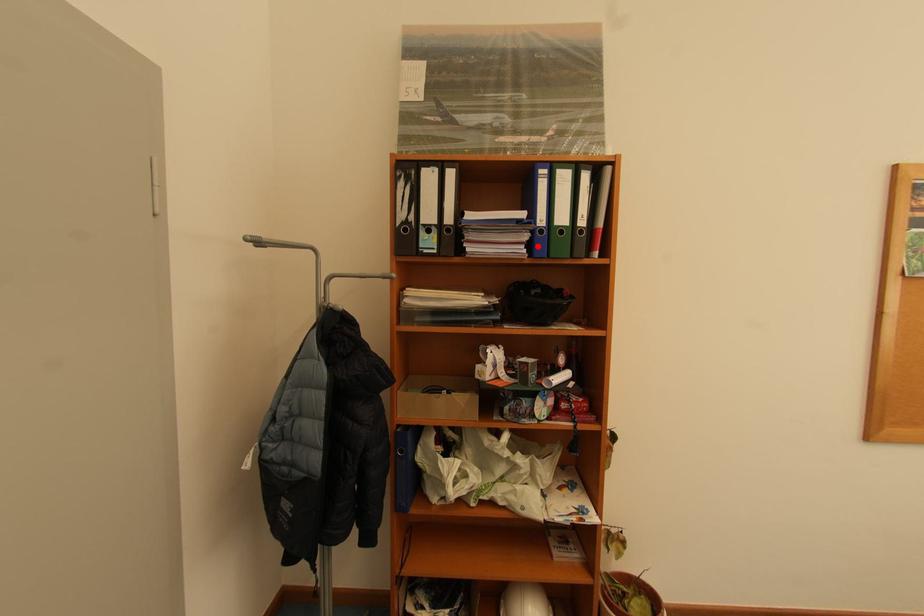
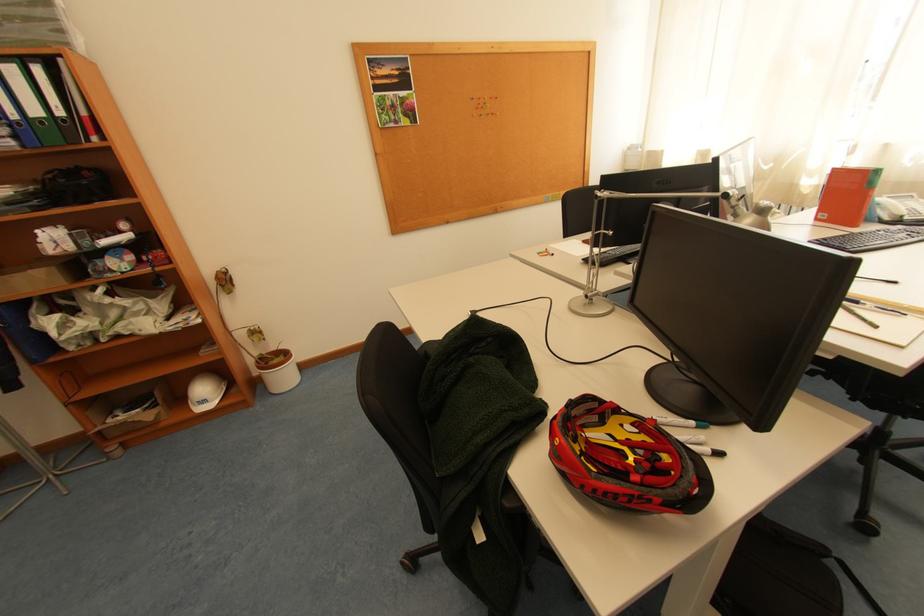
The point at the highlighted location is marked in the first image. Where is the corresponding point in the second image?

(23, 139)